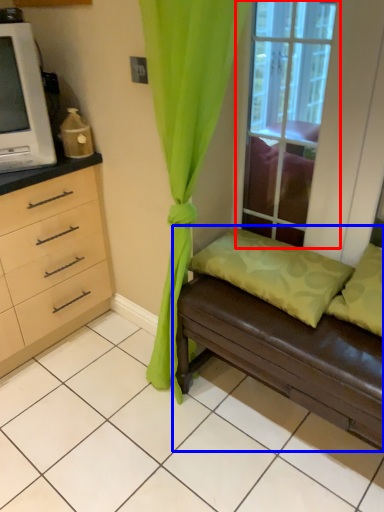
Question: Which point is closer to the camera, window (highlighted by a red box) or studio couch (highlighted by a blue box)?

Choices:
 (A) window
 (B) studio couch

Answer: (B)